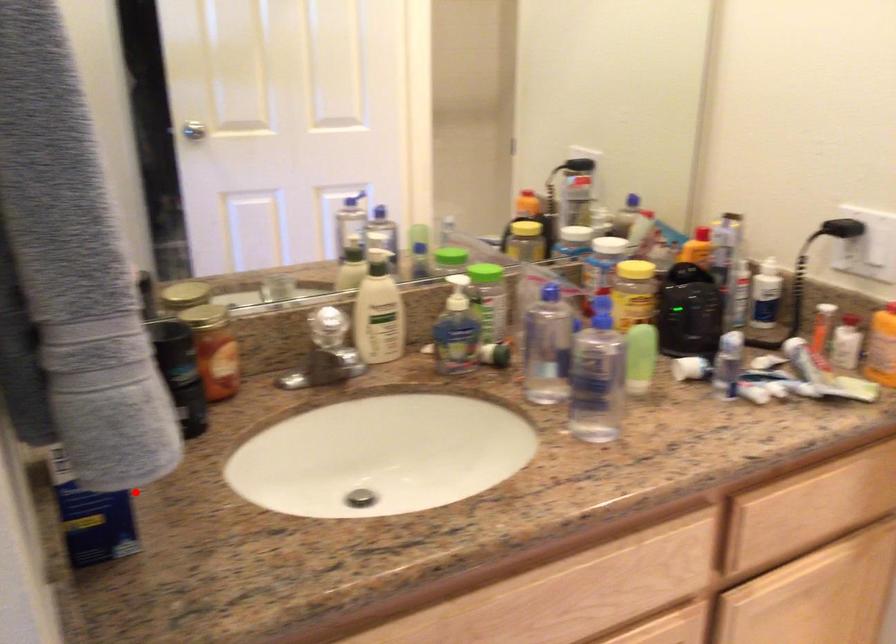
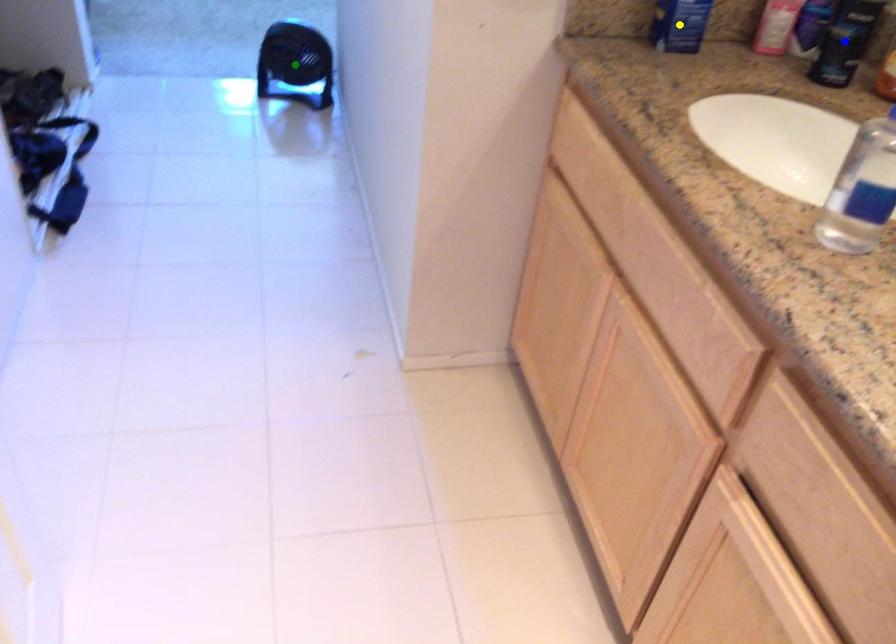
Question: I am providing you with two images of the same scene from different viewpoints. A red point is marked on the first image. You are given multiple points on the second image. Which spot in image 2 lines up with the point in image 1?

Choices:
 (A) blue point
 (B) green point
 (C) yellow point

Answer: (C)